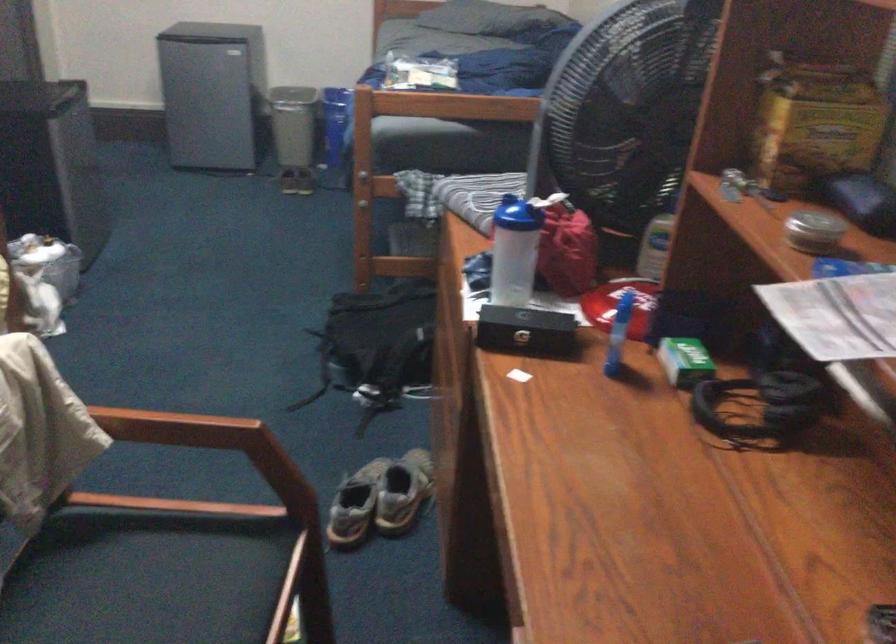
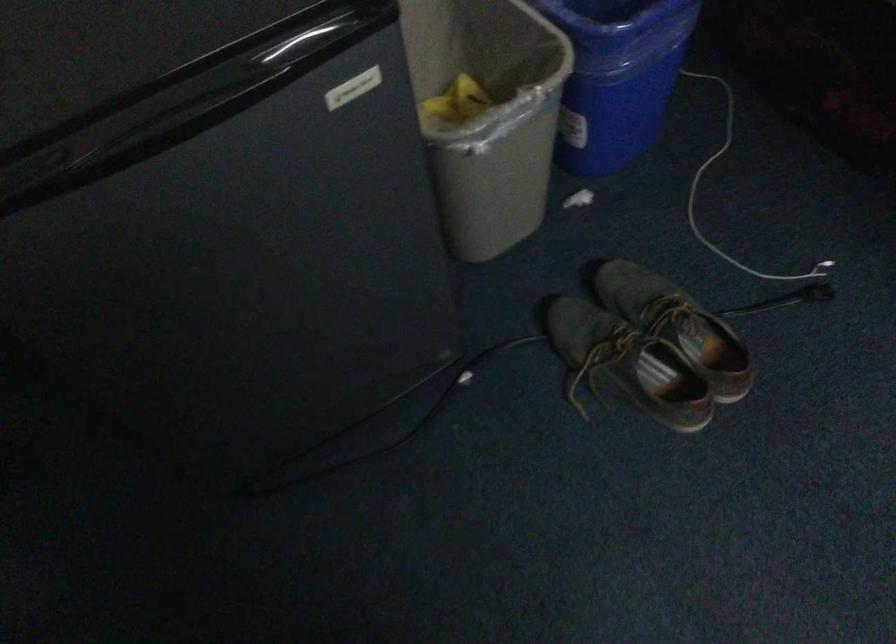
Where in the second image is the point corresponding to (x=281, y=142) from the first image?

(662, 323)